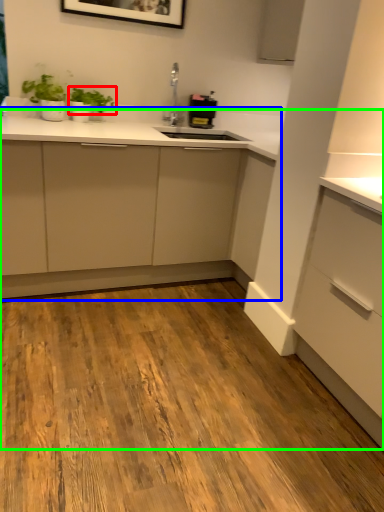
Question: Estimate the real-world distances between objects in this image. Which object is farther from plant (highlighted by a red box), cabinetry (highlighted by a blue box) or dresser (highlighted by a green box)?

Choices:
 (A) cabinetry
 (B) dresser

Answer: (A)